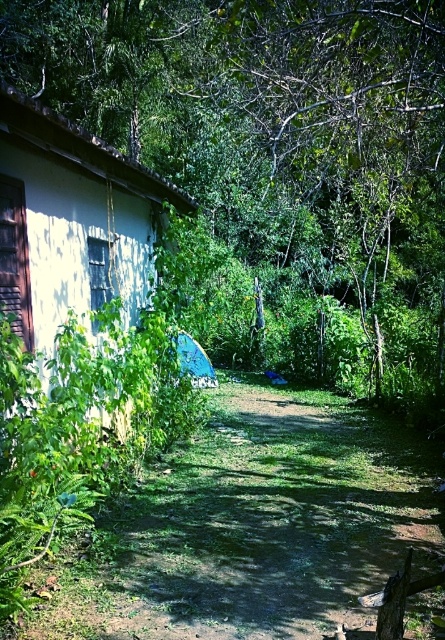
Question: Considering the relative positions of green leafy tree at center and dirt path at center in the image provided, where is green leafy tree at center located with respect to dirt path at center?

Choices:
 (A) left
 (B) right

Answer: (B)

Question: Which of these objects is positioned closest to the white matte hut at left?

Choices:
 (A) dirt path at center
 (B) green leafy tree at center

Answer: (A)

Question: Is green leafy tree at center thinner than white matte hut at left?

Choices:
 (A) no
 (B) yes

Answer: (A)

Question: Considering the real-world distances, which object is closest to the dirt path at center?

Choices:
 (A) green leafy tree at center
 (B) white matte hut at left

Answer: (B)

Question: Does dirt path at center appear over white matte hut at left?

Choices:
 (A) no
 (B) yes

Answer: (A)

Question: Which point is closer to the camera taking this photo?

Choices:
 (A) (166, 605)
 (B) (60, 128)
 (C) (231, 228)

Answer: (A)